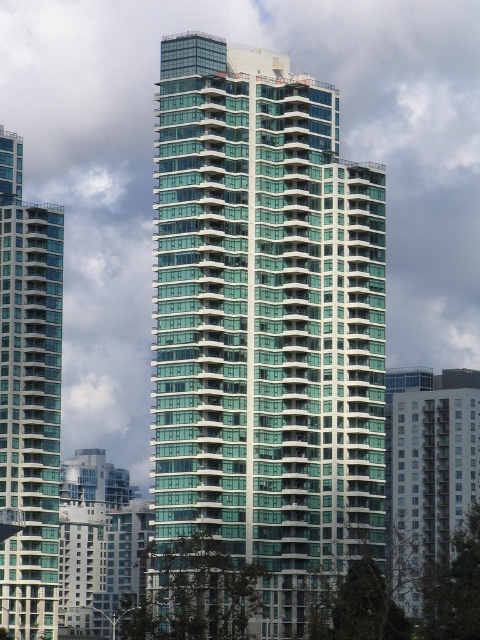
Question: Can you confirm if green glass building at center is positioned to the right of glassy teal building at left?

Choices:
 (A) no
 (B) yes

Answer: (B)

Question: Observing the image, what is the correct spatial positioning of green glass building at center in reference to glassy teal building at left?

Choices:
 (A) below
 (B) above

Answer: (B)

Question: Which point appears closest to the camera in this image?

Choices:
 (A) (320, 524)
 (B) (20, 291)

Answer: (A)

Question: Can you confirm if green glass building at center is positioned above glassy teal building at left?

Choices:
 (A) no
 (B) yes

Answer: (B)

Question: Which point is farther from the camera taking this photo?

Choices:
 (A) (44, 541)
 (B) (188, 392)

Answer: (A)